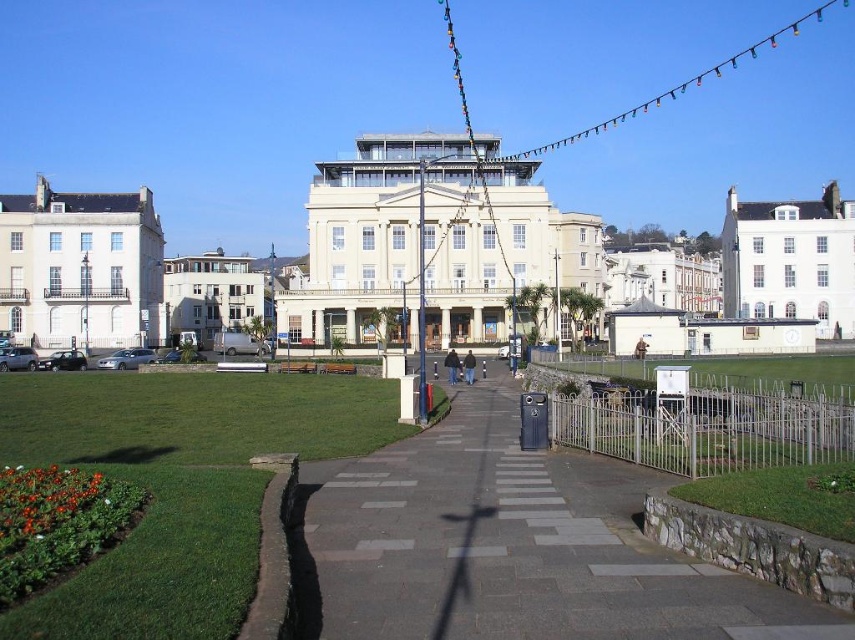
You are standing at the entrance of the park and want to reach the building in the background. There are two points marked on the path leading to the building. Which point is closer to the building? The points are point (99, 264) and point (771, 232).

Point (771, 232) is closer to the building because it is behind point (99, 264).

You are a gardener planning to plant new flowers in the urban park. You need to choose between using the gray concrete pavement at center or the green grass at lower left. Which area has more space available for planting?

The green grass at lower left has more space available for planting because it occupies more area than the gray concrete pavement at center.